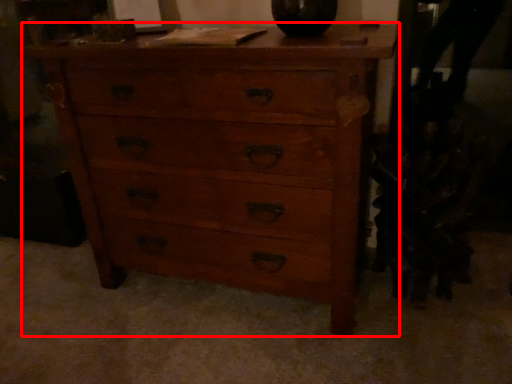
Question: From the image's perspective, where is chest of drawers (annotated by the red box) located in relation to swivel chair in the image?

Choices:
 (A) above
 (B) below

Answer: (A)